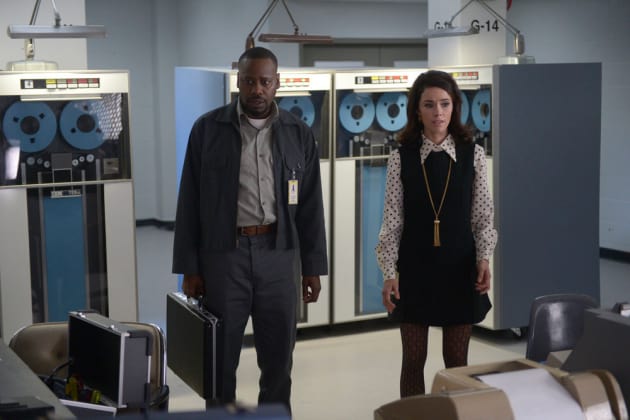
Where is `chair`? This screenshot has height=420, width=630. chair is located at coordinates (x=547, y=312).